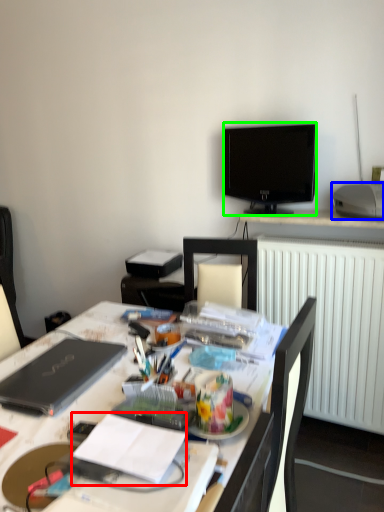
Question: Considering the real-world distances, which object is farthest from notebook (highlighted by a red box)? printer (highlighted by a blue box) or television (highlighted by a green box)?

Choices:
 (A) printer
 (B) television

Answer: (B)